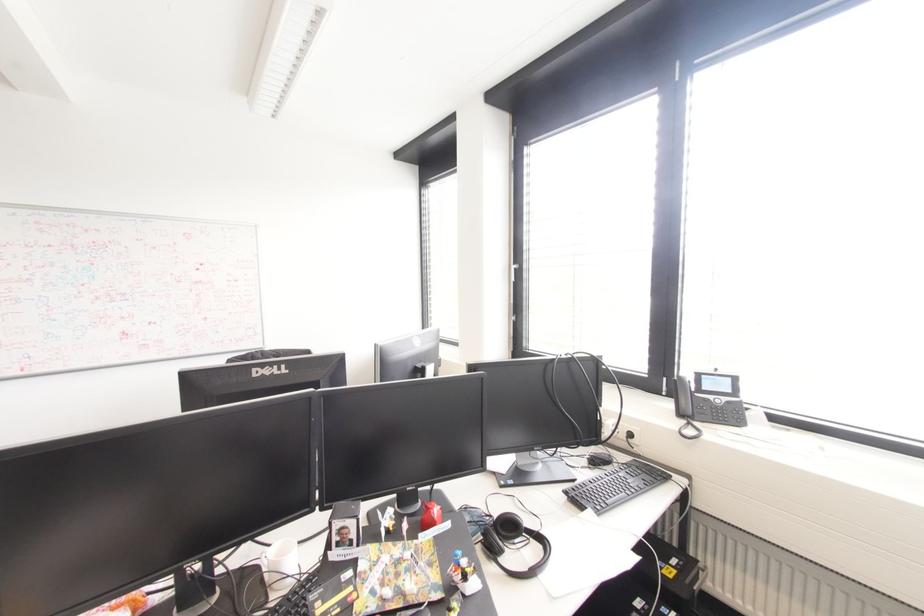
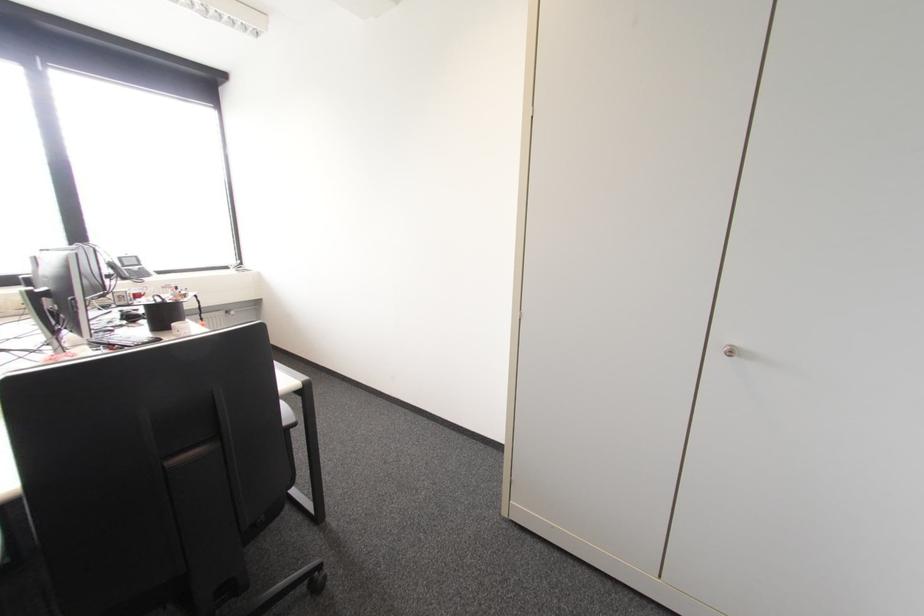
Locate, in the second image, the point that corresponds to [679,415] in the first image.

(123, 278)